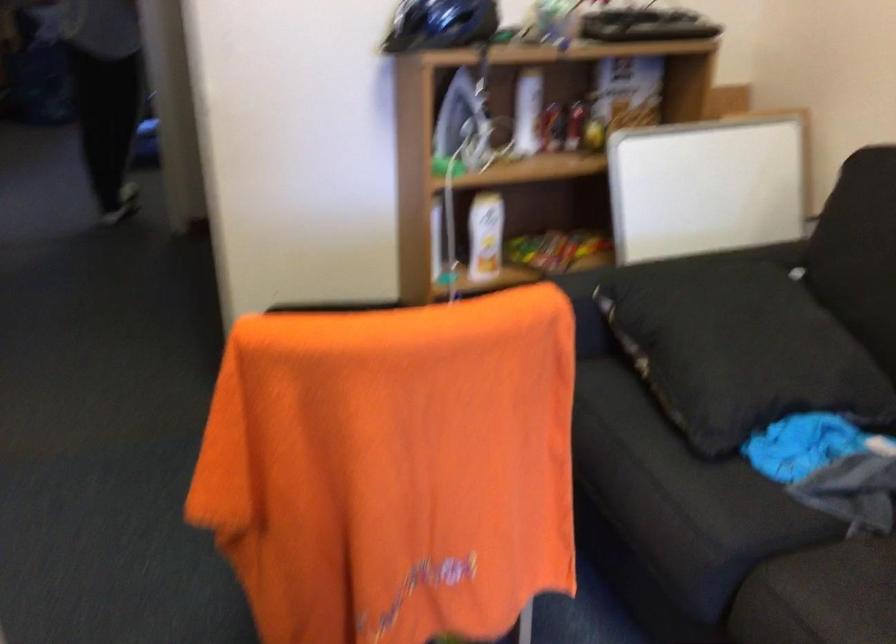
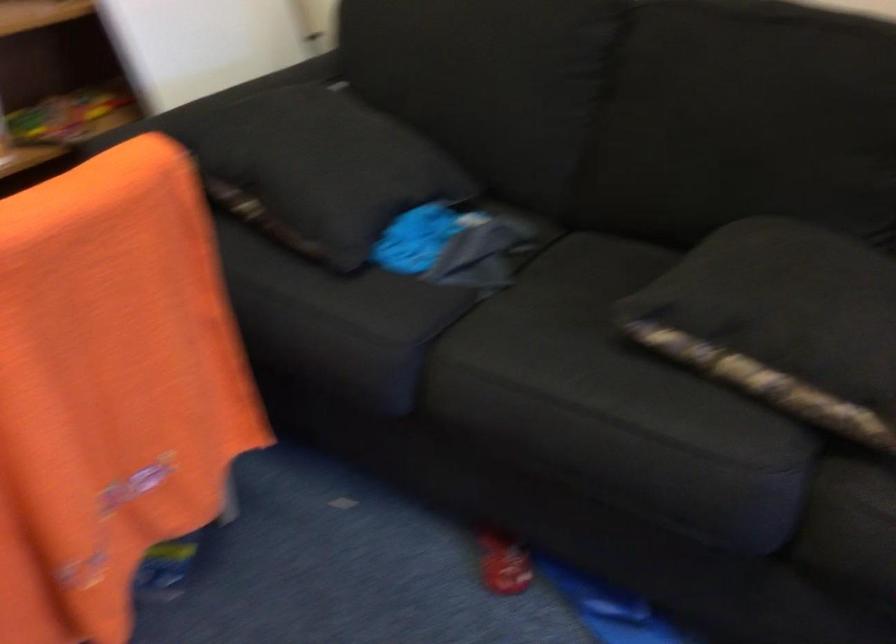
Find the pixel in the second image that matches point (721, 538) in the first image.

(400, 336)